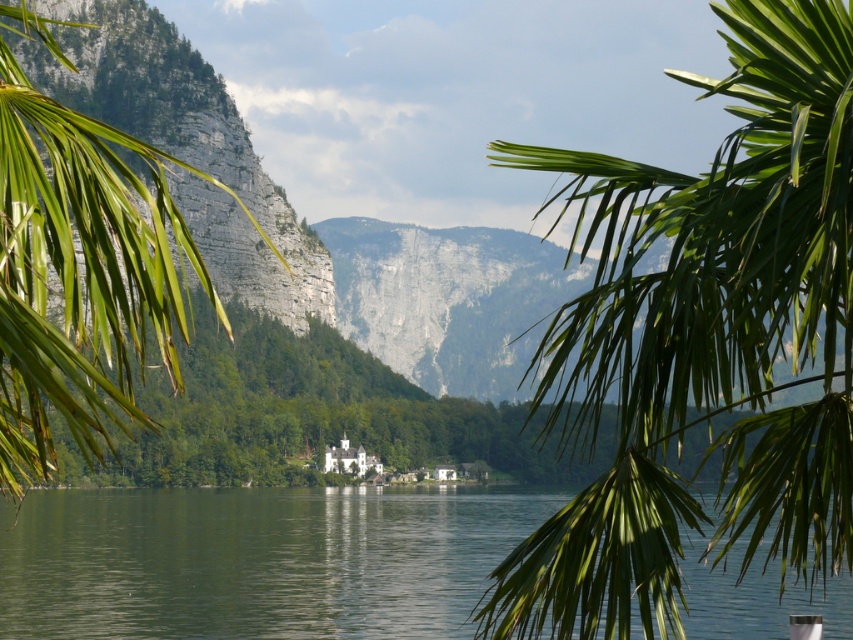
Is point (821, 280) in front of point (67, 362)?

No.

Does green leafy palm tree at upper right have a lesser width compared to green leafy palm tree at left?

Correct, green leafy palm tree at upper right's width is less than green leafy palm tree at left's.

Where is `green leafy palm tree at upper right`? This screenshot has width=853, height=640. green leafy palm tree at upper right is located at coordinates [x=704, y=339].

Is green leafy palm tree at upper right positioned before green water at center?

Yes, it is in front of green water at center.

Does green leafy palm tree at upper right lie behind green water at center?

No, it is in front of green water at center.

Between point (714, 340) and point (364, 536), which one is positioned in front?

Point (714, 340)

Find the location of a particular element. green leafy palm tree at upper right is located at coordinates click(704, 339).

Which is behind, point (300, 524) or point (26, 296)?

Point (300, 524)

Who is more distant from viewer, (247, 502) or (22, 324)?

Point (247, 502)

Locate an element on the screen. This screenshot has height=640, width=853. green water at center is located at coordinates (256, 561).